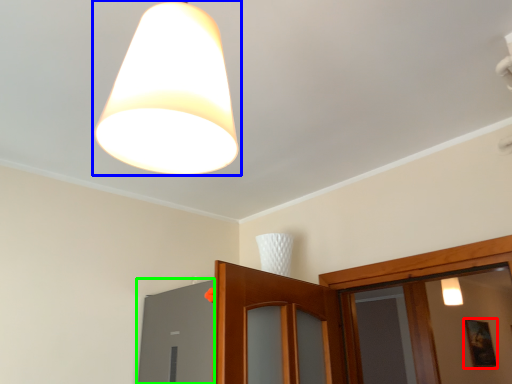
Question: Which object is the farthest from picture frame (highlighted by a red box)? Choose among these: lamp (highlighted by a blue box) or window (highlighted by a green box).

Choices:
 (A) lamp
 (B) window

Answer: (A)